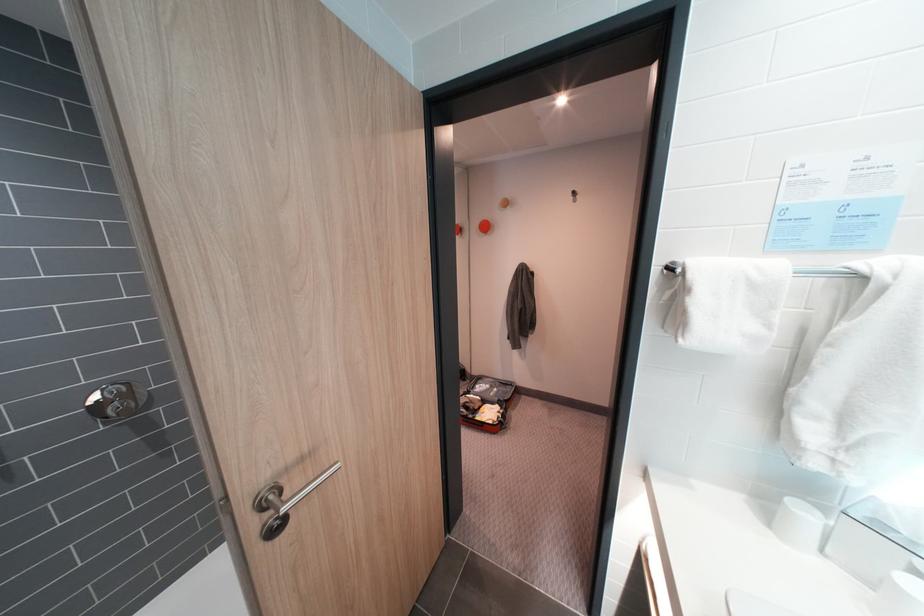
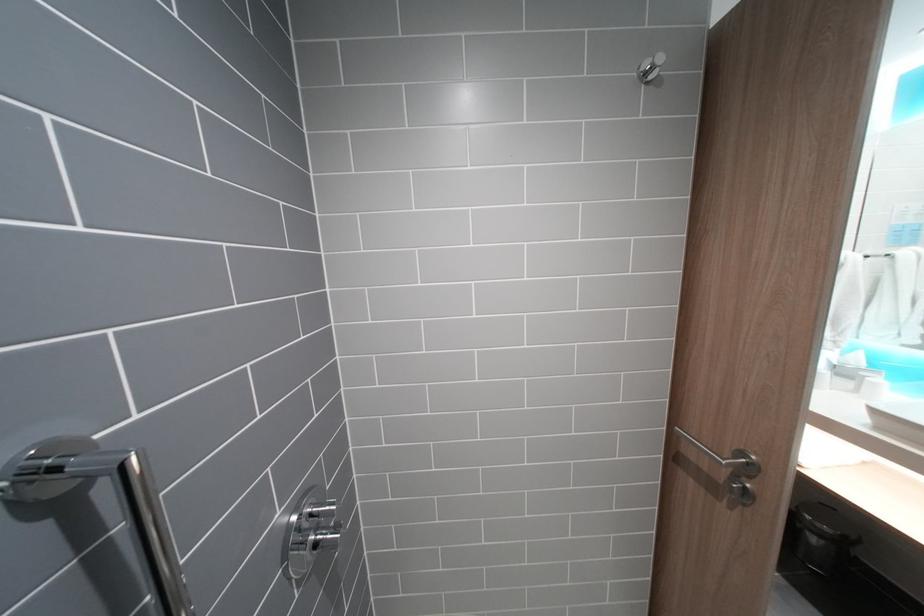
Question: In a continuous first-person perspective shot, in which direction is the camera moving?

Choices:
 (A) Left
 (B) Right
 (C) Forward
 (D) Backward

Answer: (A)